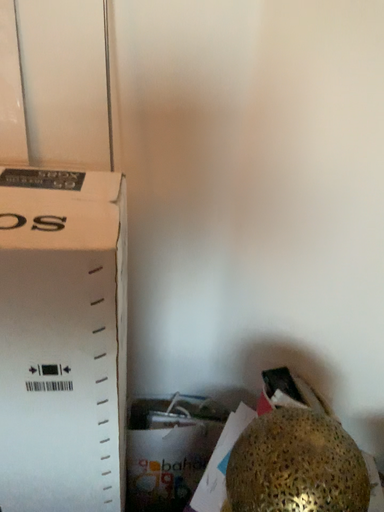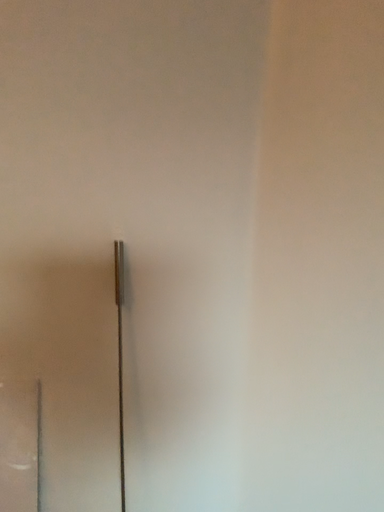
Question: How did the camera likely rotate when shooting the video?

Choices:
 (A) rotated upward
 (B) rotated downward

Answer: (A)